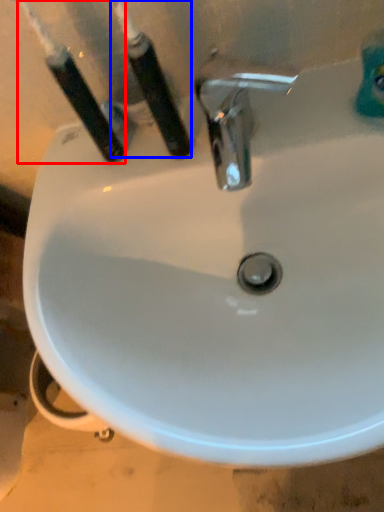
Question: Which of the following is the closest to the observer, toothbrush (highlighted by a red box) or toothbrush (highlighted by a blue box)?

Choices:
 (A) toothbrush
 (B) toothbrush

Answer: (B)